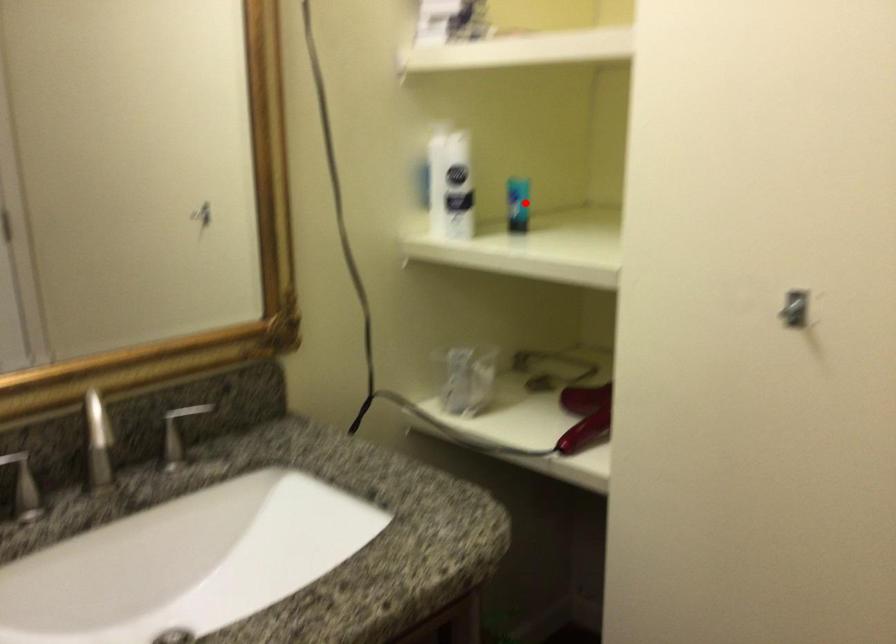
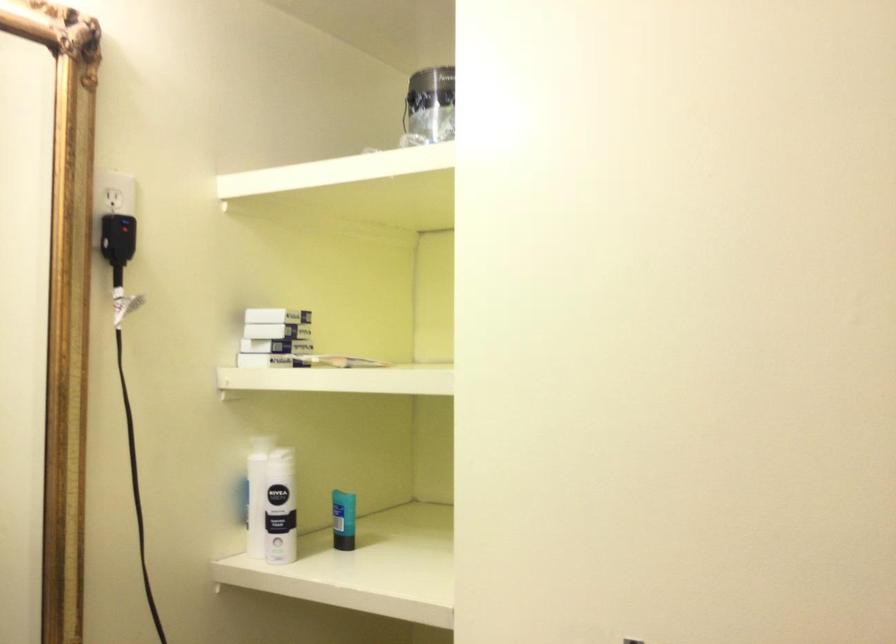
Locate, in the second image, the point that corresponds to the highlighted location in the first image.

(343, 520)